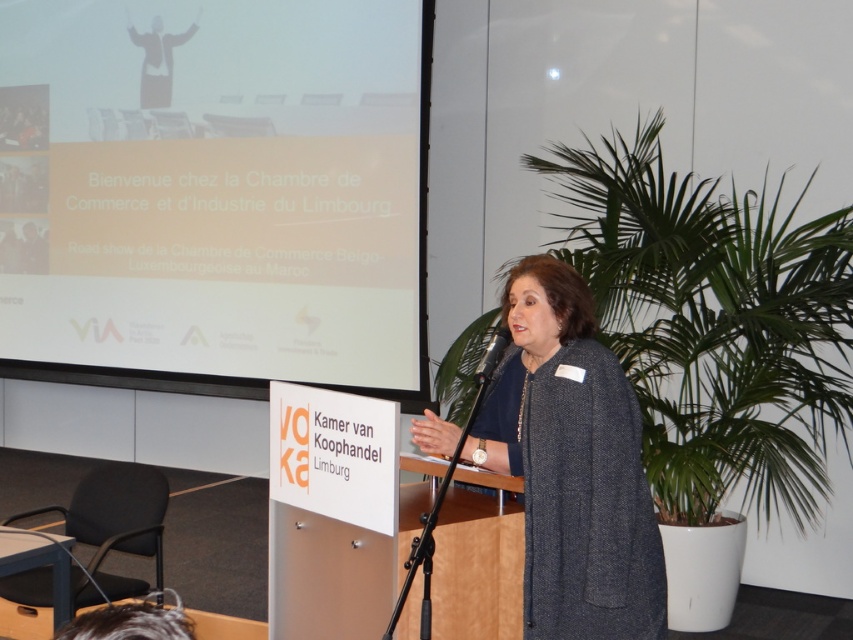
Identify the location of white matte projection screen at upper left. This screenshot has width=853, height=640. (216, 196).

Between white matte projection screen at upper left and dark gray woolen coat at center, which one has less height?

Standing shorter between the two is dark gray woolen coat at center.

Who is positioned more to the right, white matte projection screen at upper left or dark gray woolen coat at center?

dark gray woolen coat at center is more to the right.

Which is behind, point (102, 328) or point (434, 433)?

The point (102, 328) is more distant.

Image resolution: width=853 pixels, height=640 pixels. I want to click on white matte projection screen at upper left, so click(216, 196).

Who is more forward, (10, 124) or (492, 365)?

Point (492, 365) is in front.

Is white matte projection screen at upper left wider than black plastic microphone at center?

Correct, the width of white matte projection screen at upper left exceeds that of black plastic microphone at center.

The width and height of the screenshot is (853, 640). Describe the element at coordinates (216, 196) in the screenshot. I see `white matte projection screen at upper left` at that location.

Locate an element on the screen. white matte projection screen at upper left is located at coordinates (216, 196).